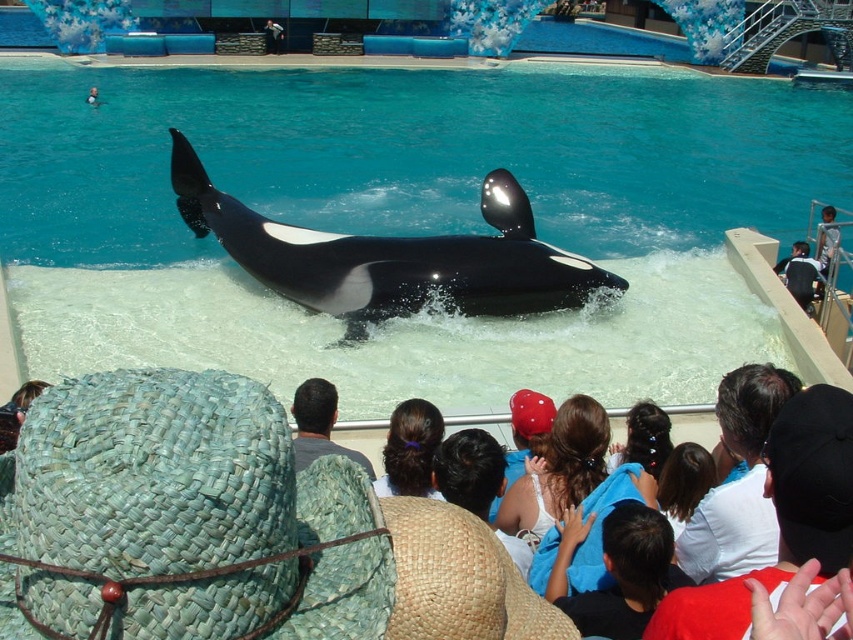
You are a photographer trying to capture the orca performance. You notice two hats in the foreground that might block your view. Which hat is closer to you, the blue woven hat at center or the woven straw hat at lower left?

The blue woven hat at center is closer to you since it is in front of the woven straw hat at lower left.

Based on the photo, what is the color of the hat located at point (618,570) in the image?

The hat at point (618,570) is blue.